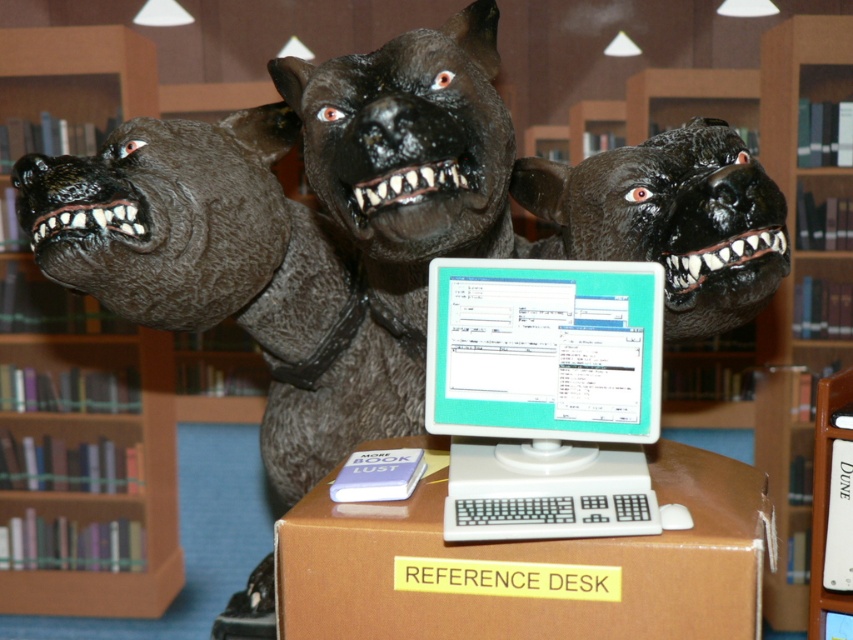
Which is more to the left, brown wooden bookshelf at upper center or wooden bookshelf at left?

wooden bookshelf at left is more to the left.

Which is behind, point (778, 140) or point (30, 593)?

The point (30, 593) is more distant.

Does point (830, 26) come farther from viewer compared to point (142, 413)?

No, (830, 26) is in front of (142, 413).

At what (x,y) coordinates should I click in order to perform the action: click on brown wooden bookshelf at upper center. Please return your answer as a coordinate pair (x, y). The height and width of the screenshot is (640, 853). Looking at the image, I should click on (792, 275).

Between brown wooden bookshelf at upper center and black rubber dog head at center, which one is positioned higher?

Positioned higher is black rubber dog head at center.

Is point (828, 292) positioned before point (686, 141)?

That is False.

Identify the location of brown wooden bookshelf at upper center. (792, 275).

Who is shorter, white plastic monitor at center or brown wooden bookshelf at upper center?

With less height is white plastic monitor at center.

Does white plastic monitor at center have a smaller size compared to brown wooden bookshelf at upper center?

Yes, white plastic monitor at center is smaller than brown wooden bookshelf at upper center.

Who is more distant from viewer, (625, 490) or (712, 394)?

Point (712, 394)

At what (x,y) coordinates should I click in order to perform the action: click on white plastic monitor at center. Please return your answer as a coordinate pair (x, y). Looking at the image, I should click on (546, 394).